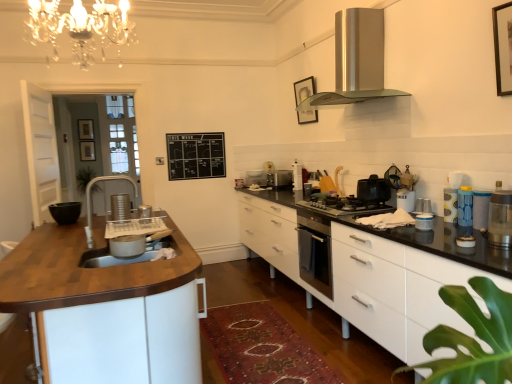
Question: Does wooden picture frame at upper center, positioned as the 2th picture frame in right-to-left order, have a lesser width compared to brushed metal faucet at left?

Choices:
 (A) no
 (B) yes

Answer: (B)

Question: Is wooden picture frame at upper center, which is the 3th picture frame from left to right, further to the viewer compared to brushed metal faucet at left?

Choices:
 (A) no
 (B) yes

Answer: (B)

Question: Is wooden picture frame at upper center, which is the 3th picture frame from left to right, not within brushed metal faucet at left?

Choices:
 (A) no
 (B) yes

Answer: (B)

Question: Is wooden picture frame at upper center, which is the 3th picture frame from left to right, to the right of brushed metal faucet at left from the viewer's perspective?

Choices:
 (A) no
 (B) yes

Answer: (B)

Question: From the image's perspective, does wooden picture frame at upper center, which is the 3th picture frame from left to right, appear lower than brushed metal faucet at left?

Choices:
 (A) yes
 (B) no

Answer: (B)

Question: Is wooden picture frame at upper center, which is the 3th picture frame from left to right, oriented away from brushed metal faucet at left?

Choices:
 (A) yes
 (B) no

Answer: (B)

Question: From the image's perspective, does satin silver toaster at left, acting as the first appliance starting from the left, appear higher than wooden picture frame at upper center, which appears as the third picture frame when viewed from the back?

Choices:
 (A) no
 (B) yes

Answer: (A)

Question: Does satin silver toaster at left, which is the seventh appliance from back to front, have a larger size compared to wooden picture frame at upper center, positioned as the 2th picture frame in right-to-left order?

Choices:
 (A) yes
 (B) no

Answer: (B)

Question: From the image's perspective, is satin silver toaster at left, acting as the first appliance starting from the left, under wooden picture frame at upper center, which is the 3th picture frame from left to right?

Choices:
 (A) yes
 (B) no

Answer: (A)

Question: Can you confirm if satin silver toaster at left, the 5th appliance in the front-to-back sequence, is shorter than wooden picture frame at upper center, positioned as the 2th picture frame in right-to-left order?

Choices:
 (A) yes
 (B) no

Answer: (A)

Question: Does satin silver toaster at left, the 5th appliance in the front-to-back sequence, lie in front of wooden picture frame at upper center, which is the 3th picture frame from left to right?

Choices:
 (A) yes
 (B) no

Answer: (A)

Question: From a real-world perspective, is satin silver toaster at left, arranged as the eleventh appliance when viewed from the right, physically above wooden picture frame at upper center, acting as the second picture frame starting from the front?

Choices:
 (A) no
 (B) yes

Answer: (A)

Question: From a real-world perspective, does satin silver toaster at center, which is the 10th appliance from right to left, sit lower than white glossy container at right, which is the fifth appliance from right to left?

Choices:
 (A) yes
 (B) no

Answer: (B)